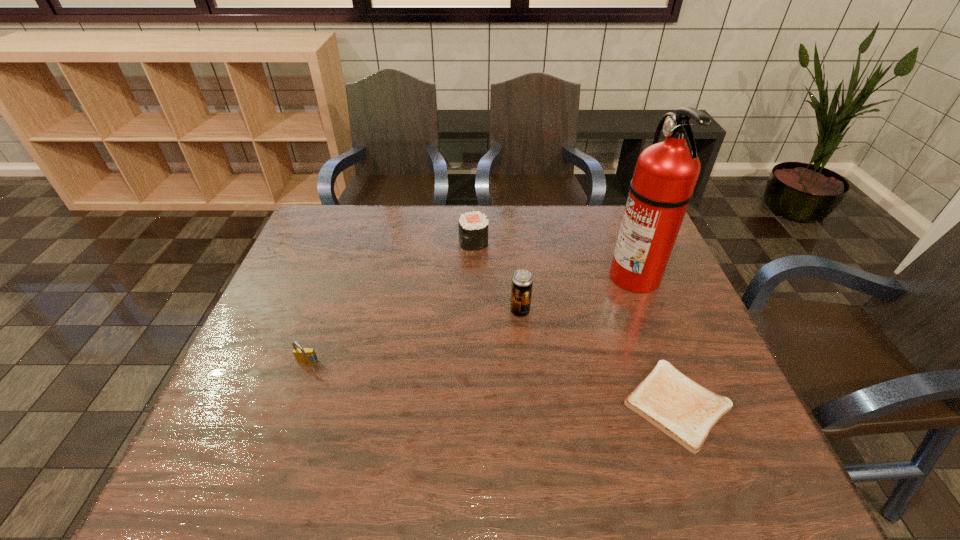
Where is `blank space located on the right of the sushi`? blank space located on the right of the sushi is located at coordinates (523, 242).

Locate an element on the screen. Image resolution: width=960 pixels, height=540 pixels. vacant region located 0.080m on the side with the combination dials of the padlock is located at coordinates [295, 399].

Identify the location of free space located 0.360m on the left of the shortest object. (462, 405).

Find the location of `object located at the far edge`. object located at the far edge is located at coordinates (473, 227).

Where is `object located in the near edge section of the desktop`? The image size is (960, 540). object located in the near edge section of the desktop is located at coordinates (685, 411).

You are a GUI agent. You are given a task and a screenshot of the screen. Output one action in this format:
    pyautogui.click(x=<x>, y=<y>)
    Task: Click on the object at the left edge
    This screenshot has width=960, height=540.
    Given the screenshot: What is the action you would take?
    pyautogui.click(x=303, y=355)

This screenshot has width=960, height=540. What are the coordinates of `fire extinguisher that is positioned at the right edge` in the screenshot? It's located at (666, 173).

Where is `toast present at the right edge`? The width and height of the screenshot is (960, 540). toast present at the right edge is located at coordinates (685, 411).

At what (x,y) coordinates should I click in order to perform the action: click on object present at the near right corner. Please return your answer as a coordinate pair (x, y). Looking at the image, I should click on (685, 411).

This screenshot has width=960, height=540. In the image, there is a desktop. What are the coordinates of `free space at the far edge` in the screenshot? It's located at (408, 243).